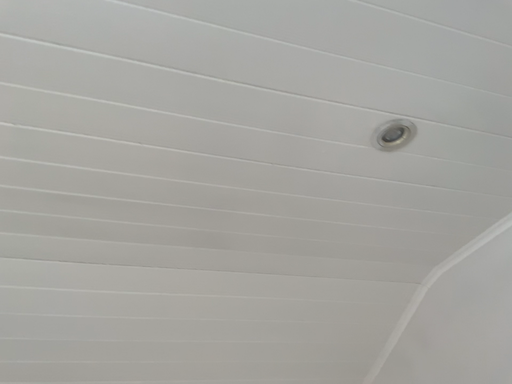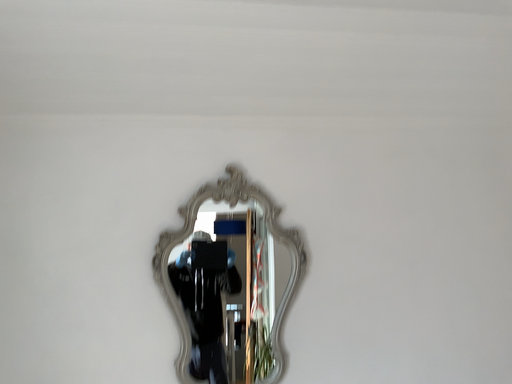
Question: Which way did the camera rotate in the video?

Choices:
 (A) rotated left
 (B) rotated right

Answer: (A)